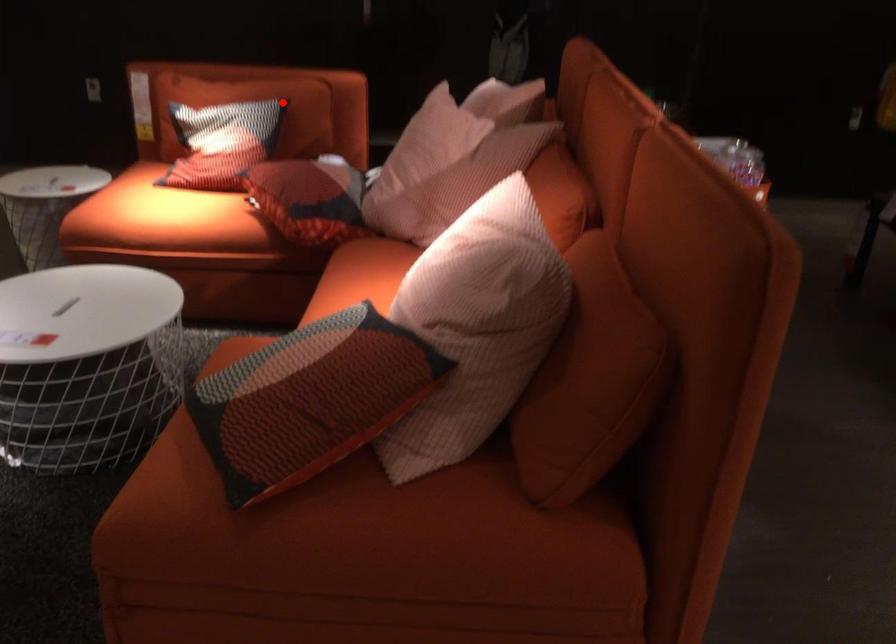
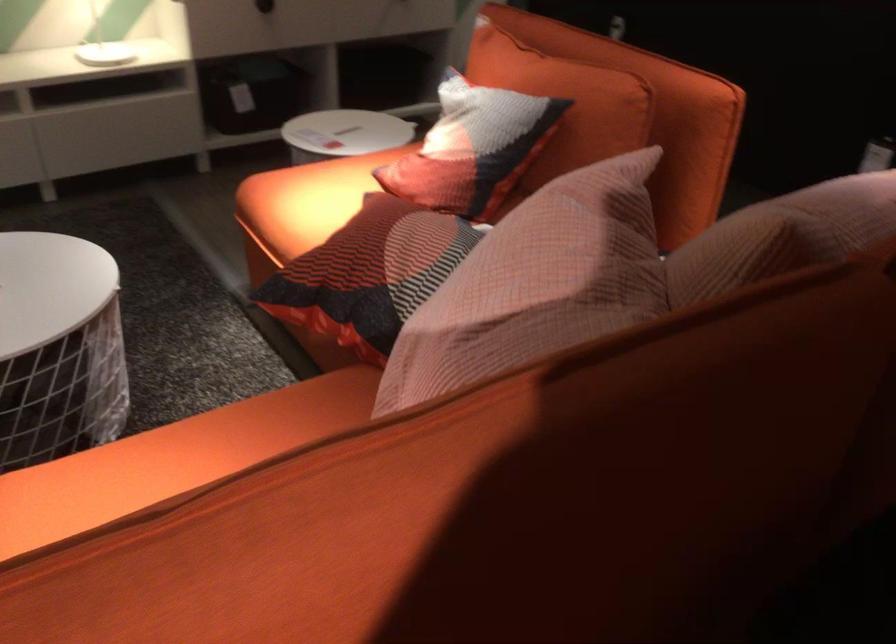
Question: I am providing you with two images of the same scene from different viewpoints. Image1 has a red point marked. In image2, the corresponding 3D location appears at what relative position? Reply with the corresponding letter.

Choices:
 (A) Closer
 (B) Farther

Answer: (A)